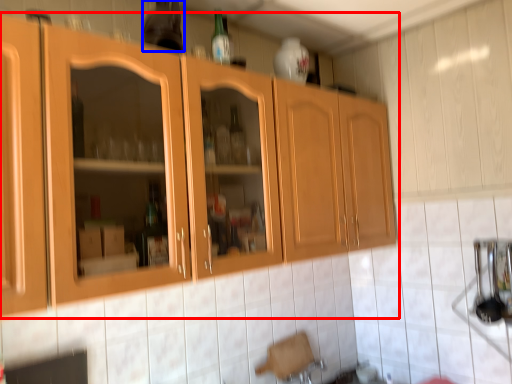
Question: Which object is further to the camera taking this photo, cabinetry (highlighted by a red box) or bottle (highlighted by a blue box)?

Choices:
 (A) cabinetry
 (B) bottle

Answer: (B)